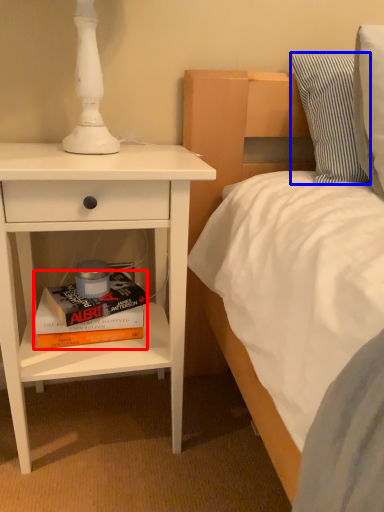
Question: Which point is closer to the camera, book (highlighted by a red box) or pillow (highlighted by a blue box)?

Choices:
 (A) book
 (B) pillow

Answer: (B)